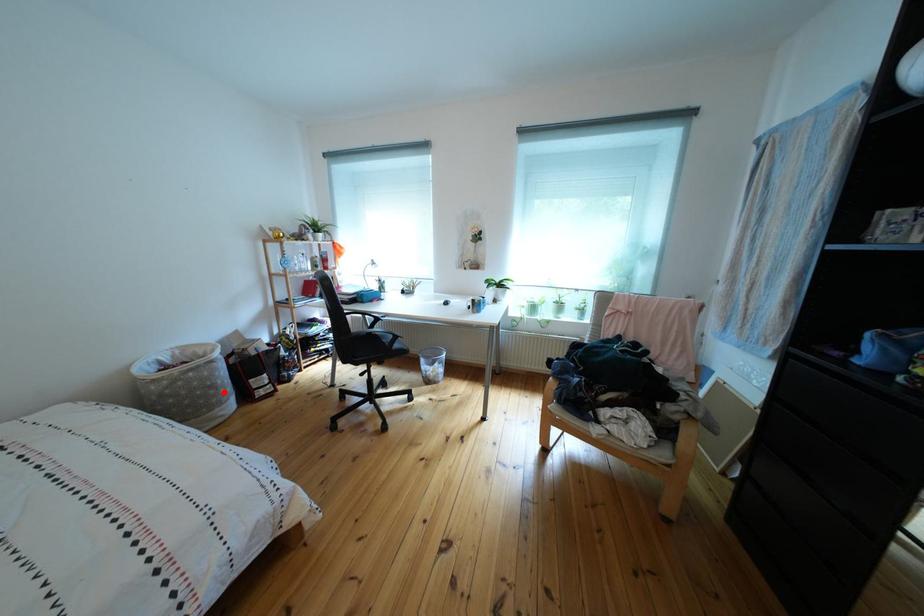
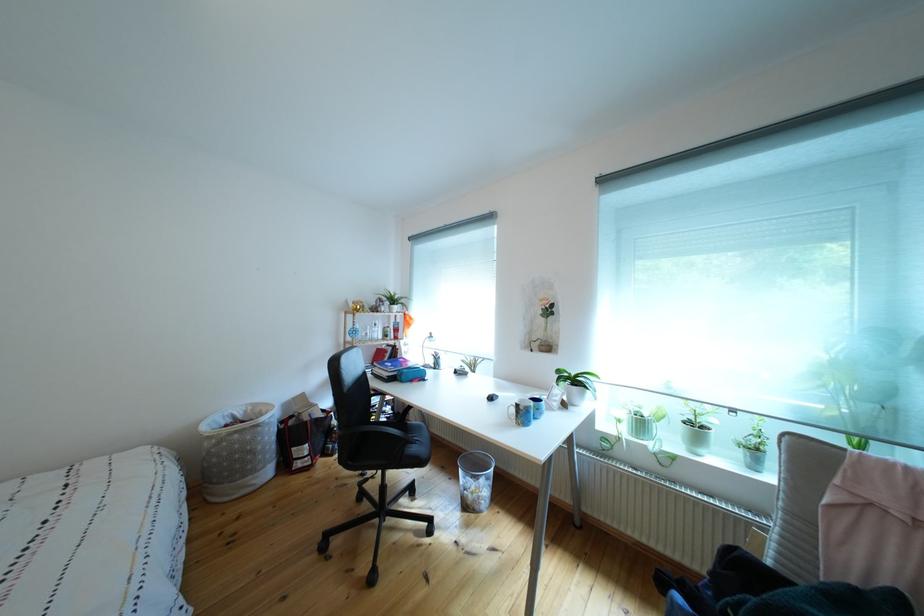
Question: I am providing you with two images of the same scene from different viewpoints. A red point is shown in image1. For the corresponding object point in image2, is it positioned nearer or farther from the camera?

Choices:
 (A) Nearer
 (B) Farther

Answer: (B)